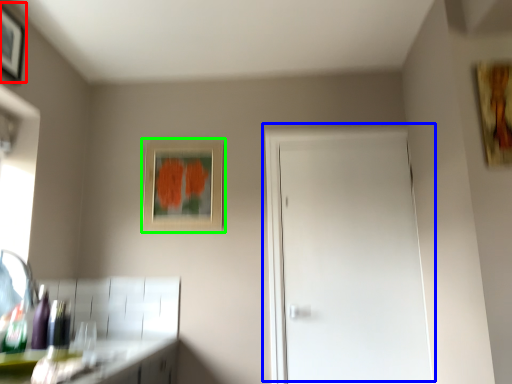
Question: Which object is positioned closest to picture frame (highlighted by a red box)? Select from door (highlighted by a blue box) and picture frame (highlighted by a green box).

Choices:
 (A) door
 (B) picture frame

Answer: (B)